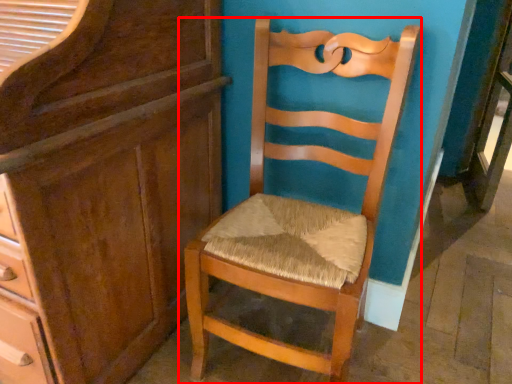
Question: From the image's perspective, where is chair (annotated by the red box) located in relation to cabinetry in the image?

Choices:
 (A) above
 (B) below

Answer: (B)